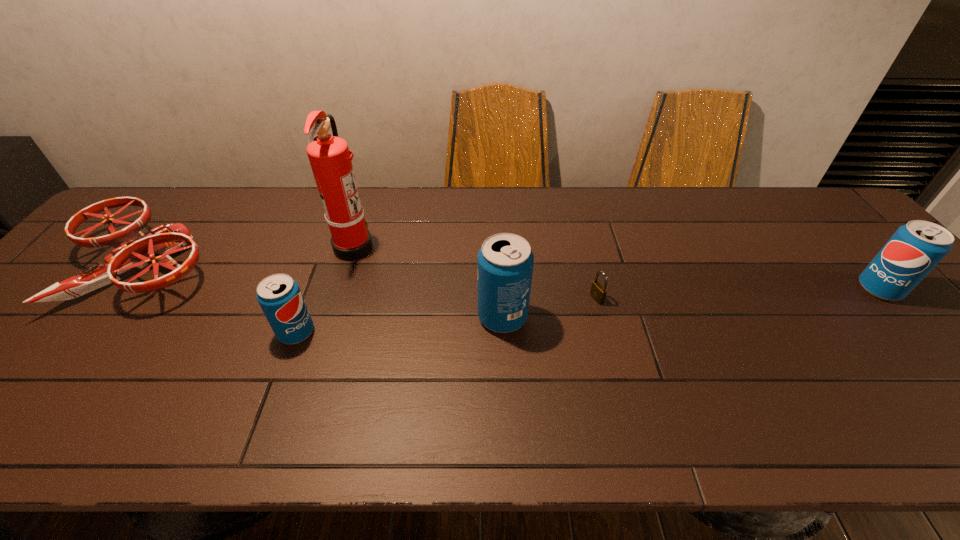
Where is `empty space between the second object from right to left and the third object from right to left`? The image size is (960, 540). empty space between the second object from right to left and the third object from right to left is located at coordinates (549, 308).

Locate which object ranks second in proximity to the fire extinguisher. Please provide its 2D coordinates. Your answer should be formatted as a tuple, i.e. [(x, y)], where the tuple contains the x and y coordinates of a point satisfying the conditions above.

[(135, 249)]

Locate an element on the screen. Image resolution: width=960 pixels, height=540 pixels. object that is the fourth closest to the tallest object is located at coordinates (598, 292).

Identify the location of the second closest soda can to the rightmost object. This screenshot has height=540, width=960. (279, 295).

The height and width of the screenshot is (540, 960). In order to click on the closest soda can to the second soda can from left to right in this screenshot , I will do `click(279, 295)`.

Where is `free region that satisfies the following two spatial constraints: 1. at the nozzle of the fire extinguisher; 2. on the right side of the rightmost soda can`? The image size is (960, 540). free region that satisfies the following two spatial constraints: 1. at the nozzle of the fire extinguisher; 2. on the right side of the rightmost soda can is located at coordinates (341, 289).

I want to click on free location that satisfies the following two spatial constraints: 1. at the nozzle of the second shortest soda can; 2. on the right side of the fire extinguisher, so click(x=341, y=289).

This screenshot has width=960, height=540. I want to click on free space that satisfies the following two spatial constraints: 1. at the nozzle of the tallest object; 2. on the left side of the fourth object from left to right, so click(x=332, y=317).

Locate an element on the screen. Image resolution: width=960 pixels, height=540 pixels. vacant position in the image that satisfies the following two spatial constraints: 1. at the nozzle of the fire extinguisher; 2. on the left side of the padlock is located at coordinates pos(338,299).

Identify the location of free region that satisfies the following two spatial constraints: 1. at the nozzle of the fire extinguisher; 2. on the left side of the shortest object. The width and height of the screenshot is (960, 540). (338, 299).